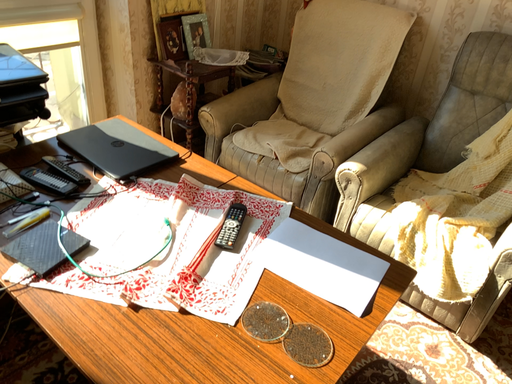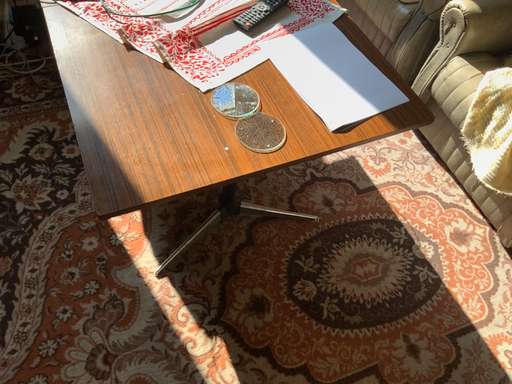
Question: How did the camera likely rotate when shooting the video?

Choices:
 (A) rotated right
 (B) rotated left

Answer: (B)